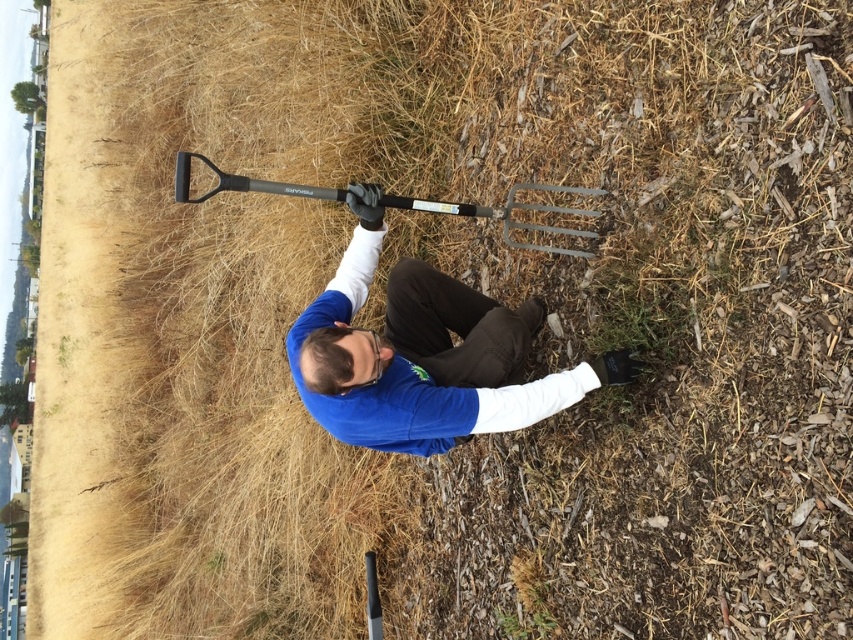
Question: Does matte black pitchfork at center appear on the left side of black plastic shovel at upper center?

Choices:
 (A) yes
 (B) no

Answer: (A)

Question: Can you confirm if matte black pitchfork at center is positioned above black plastic shovel at upper center?

Choices:
 (A) no
 (B) yes

Answer: (A)

Question: Can you confirm if matte black pitchfork at center is positioned above black plastic shovel at upper center?

Choices:
 (A) no
 (B) yes

Answer: (A)

Question: Which point appears farthest from the camera in this image?

Choices:
 (A) (393, 205)
 (B) (347, 266)

Answer: (B)